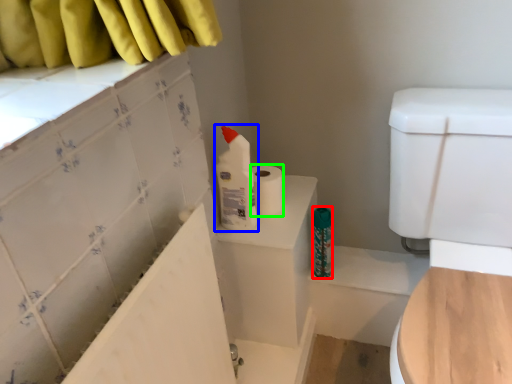
Question: Estimate the real-world distances between objects in this image. Which object is farther from toiletry (highlighted by a red box), cleaning product (highlighted by a blue box) or toilet paper (highlighted by a green box)?

Choices:
 (A) cleaning product
 (B) toilet paper

Answer: (A)